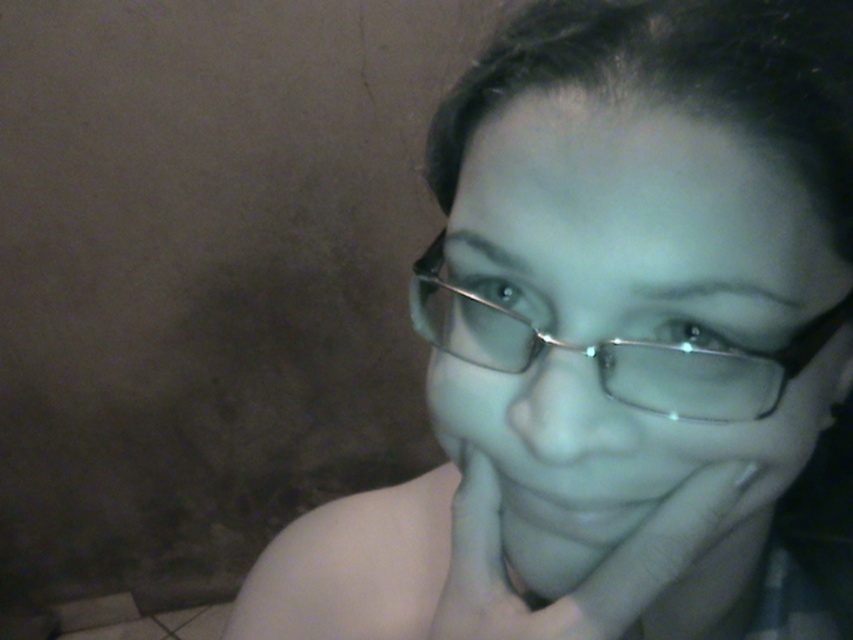
Question: Considering the real-world distances, which object is farthest from the metallic frame glasses at center?

Choices:
 (A) clear plastic glasses at center
 (B) smooth skin hand at center

Answer: (B)

Question: Does clear plastic glasses at center appear under smooth skin hand at center?

Choices:
 (A) yes
 (B) no

Answer: (B)

Question: Which point is closer to the camera taking this photo?

Choices:
 (A) (798, 262)
 (B) (602, 374)

Answer: (A)

Question: Is clear plastic glasses at center to the right of metallic frame glasses at center from the viewer's perspective?

Choices:
 (A) yes
 (B) no

Answer: (A)

Question: Does clear plastic glasses at center have a larger size compared to metallic frame glasses at center?

Choices:
 (A) yes
 (B) no

Answer: (B)

Question: Among these points, which one is nearest to the camera?

Choices:
 (A) (614, 634)
 (B) (654, 401)
 (C) (756, 273)

Answer: (C)